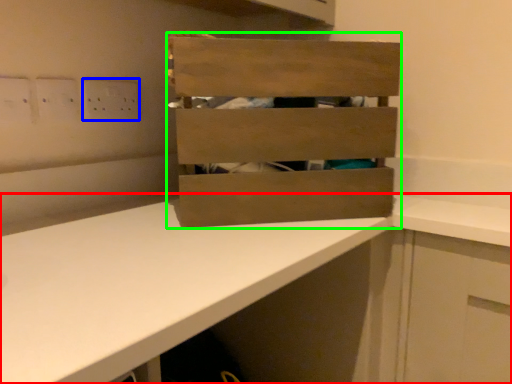
Question: Based on their relative distances, which object is nearer to countertop (highlighted by a red box)? Choose from electric outlet (highlighted by a blue box) and crate (highlighted by a green box).

Choices:
 (A) electric outlet
 (B) crate

Answer: (B)